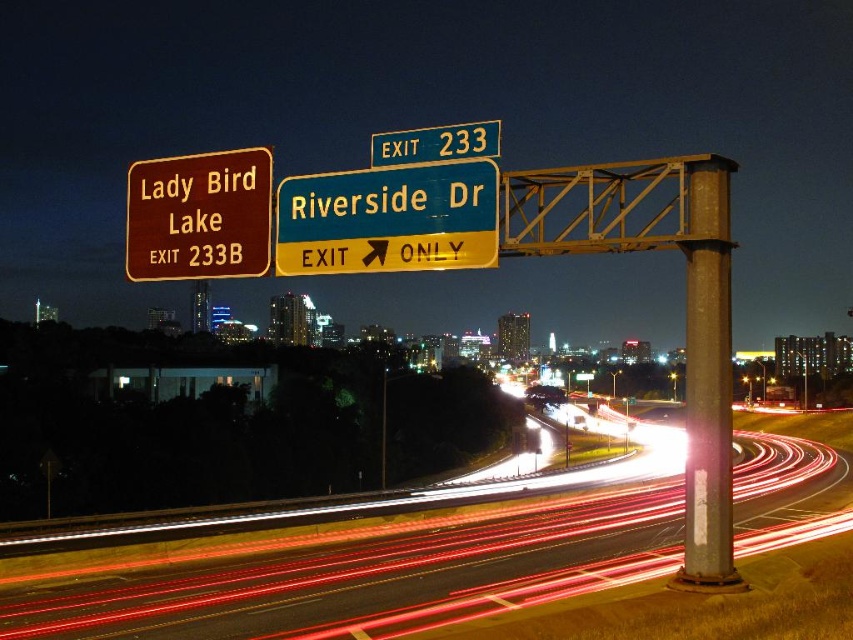
Who is positioned more to the left, yellow/green plastic sign at upper center or brown wooden sign at upper left?

Positioned to the left is brown wooden sign at upper left.

Is point (340, 268) positioned before point (212, 268)?

Yes, it is in front of point (212, 268).

You are a GUI agent. You are given a task and a screenshot of the screen. Output one action in this format:
    pyautogui.click(x=<x>, y=<y>)
    Task: Click on the yellow/green plastic sign at upper center
    This screenshot has width=853, height=640.
    Given the screenshot: What is the action you would take?
    pyautogui.click(x=389, y=218)

You are a GUI agent. You are given a task and a screenshot of the screen. Output one action in this format:
    pyautogui.click(x=<x>, y=<y>)
    Task: Click on the yellow/green plastic sign at upper center
    
    Given the screenshot: What is the action you would take?
    pyautogui.click(x=389, y=218)

Consider the image. Does metallic gray pole at center-right have a greater height compared to yellow/golden metal/texture exit sign at upper center?

Indeed, metallic gray pole at center-right has a greater height compared to yellow/golden metal/texture exit sign at upper center.

Which is above, metallic gray pole at center-right or yellow/golden metal/texture exit sign at upper center?

yellow/golden metal/texture exit sign at upper center

The height and width of the screenshot is (640, 853). Describe the element at coordinates (706, 374) in the screenshot. I see `metallic gray pole at center-right` at that location.

The height and width of the screenshot is (640, 853). What are the coordinates of `metallic gray pole at center-right` in the screenshot? It's located at (706, 374).

Which is more to the left, white light trails at center or yellow/golden metal/texture exit sign at upper center?

Positioned to the left is yellow/golden metal/texture exit sign at upper center.

Does white light trails at center have a greater height compared to yellow/golden metal/texture exit sign at upper center?

Yes, white light trails at center is taller than yellow/golden metal/texture exit sign at upper center.

Find the location of a particular element. The height and width of the screenshot is (640, 853). white light trails at center is located at coordinates (370, 579).